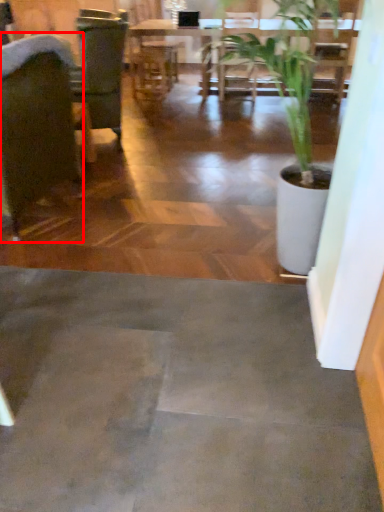
Question: From the image's perspective, what is the correct spatial positioning of chair (annotated by the red box) in reference to table?

Choices:
 (A) below
 (B) above

Answer: (A)